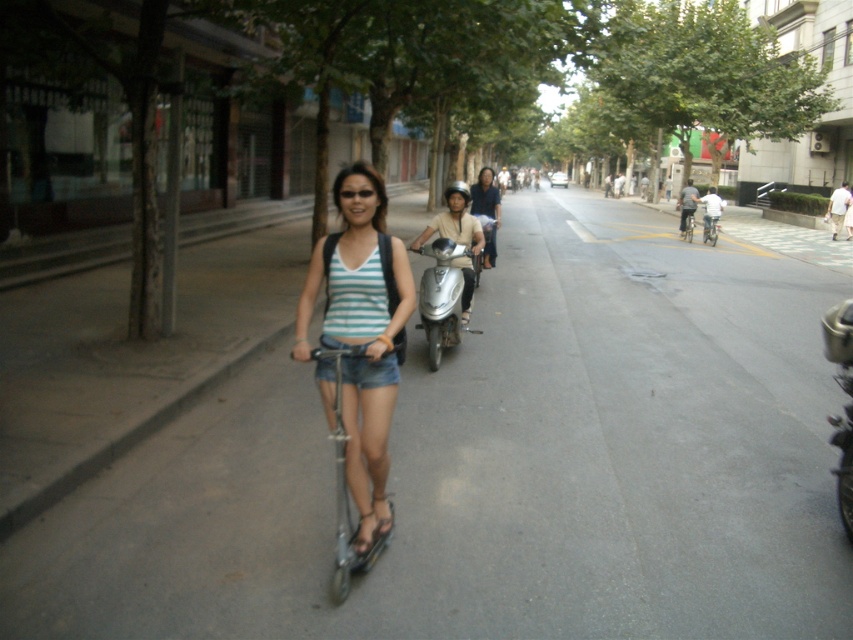
Question: Which point is farther to the camera?

Choices:
 (A) (489, 186)
 (B) (834, 340)
 (C) (430, 332)
 (D) (711, 550)

Answer: (A)

Question: Which point is farther to the camera?

Choices:
 (A) (489, 212)
 (B) (451, 259)

Answer: (A)

Question: Does metallic scooter at center have a larger size compared to silver metallic scooter at center?

Choices:
 (A) no
 (B) yes

Answer: (B)

Question: Can you confirm if gray asphalt road at center is bigger than matte striped tank top at center?

Choices:
 (A) no
 (B) yes

Answer: (B)

Question: Estimate the real-world distances between objects in this image. Which object is closer to the gray asphalt road at center?

Choices:
 (A) matte striped tank top at center
 (B) shiny chrome motorcycle at right
 (C) silver metallic bicycle at center-right

Answer: (A)

Question: Is shiny chrome motorcycle at right smaller than silver metallic bicycle at center?

Choices:
 (A) yes
 (B) no

Answer: (A)